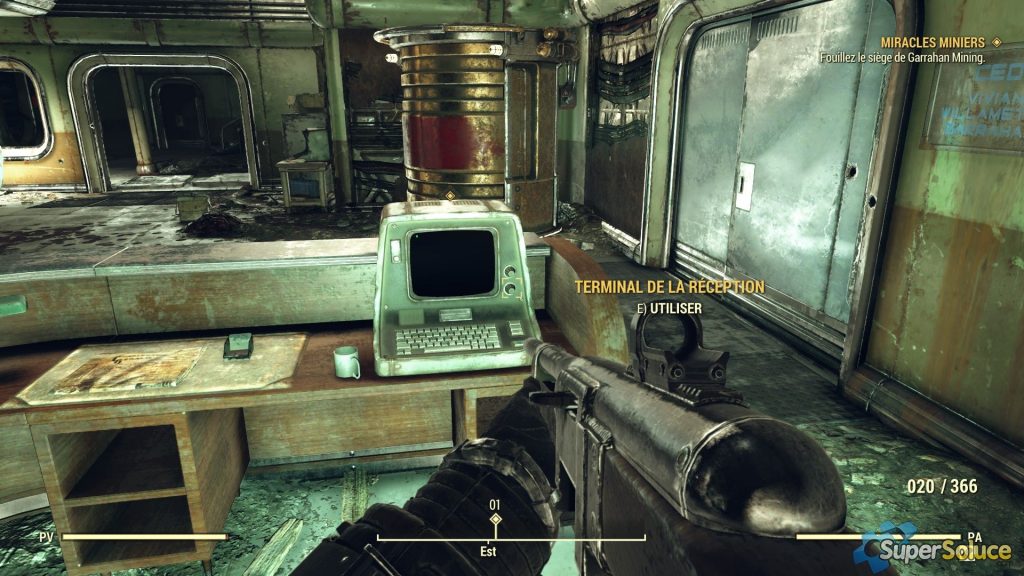
Locate an element on the screen. white coffee cup is located at coordinates (338, 360).